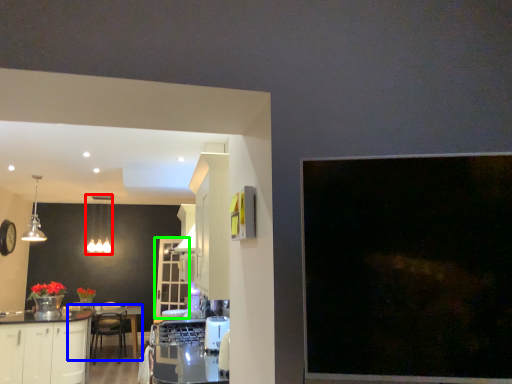
Question: Based on their relative distances, which object is farther from lighting (highlighted by a red box)? Choose from round table (highlighted by a blue box) and glass door (highlighted by a green box).

Choices:
 (A) round table
 (B) glass door

Answer: (A)